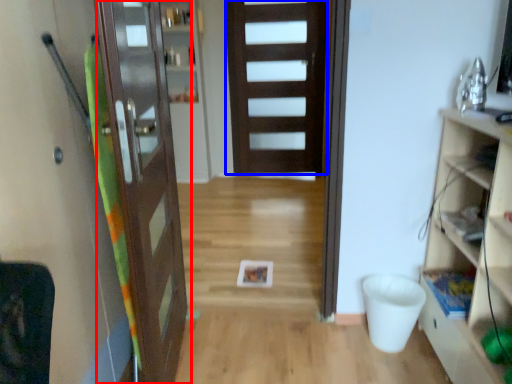
Question: Which object is further to the camera taking this photo, door (highlighted by a red box) or door (highlighted by a blue box)?

Choices:
 (A) door
 (B) door

Answer: (B)